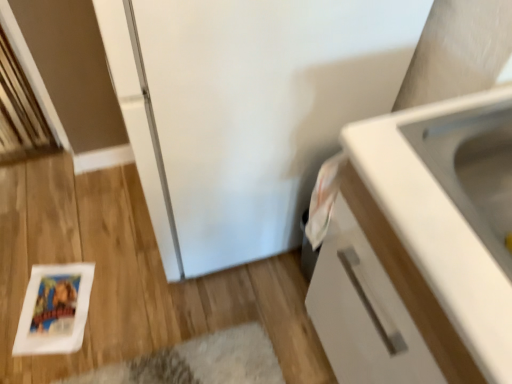
Question: Is point (366, 281) positioned closer to the camera than point (474, 114)?

Choices:
 (A) farther
 (B) closer

Answer: (A)

Question: Is white matte cabinet at right in front of or behind white glossy sink at upper right in the image?

Choices:
 (A) front
 (B) behind

Answer: (A)

Question: From the image's perspective, is white matte cabinet at right above or below white glossy sink at upper right?

Choices:
 (A) below
 (B) above

Answer: (A)

Question: From a real-world perspective, is white glossy sink at upper right physically located above or below white matte cabinet at right?

Choices:
 (A) above
 (B) below

Answer: (A)

Question: From the image's perspective, is white glossy sink at upper right above or below white matte cabinet at right?

Choices:
 (A) below
 (B) above

Answer: (B)

Question: Is white glossy sink at upper right in front of or behind white matte cabinet at right in the image?

Choices:
 (A) behind
 (B) front

Answer: (A)

Question: Would you say white glossy sink at upper right is to the left or to the right of white matte cabinet at right in the picture?

Choices:
 (A) left
 (B) right

Answer: (A)